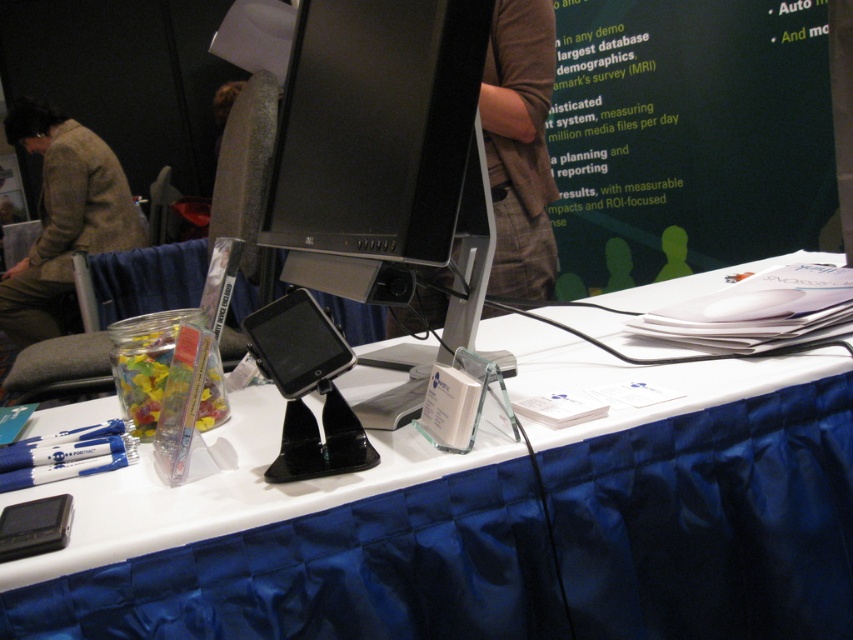
You are standing at the front of the trade show booth and want to place a promotional banner on the white glossy table at center. The banner is 24 inches wide. Can the banner fit on the table without overlapping the edges?

The white glossy table at center is 22.85 inches from camera, but the distance does not indicate the table width. The banner may not fit, but the provided information does not specify the table dimensions, so we cannot confirm.

You are at a trade show and need to locate the white glossy table at center. Based on the scene description, where would you find it?

The white glossy table at center is located at point coordinates of (296, 548).

You are a photographer setting up a shot of the booth. You want to ensure both the brown plaid shirt at upper center and the brown textured jacket at upper left are visible in the frame. Which item might require you to adjust your camera angle to include it fully?

The brown textured jacket at upper left might require adjusting the camera angle because it occupies more space than the brown plaid shirt at upper center, making it harder to fit into the frame without repositioning.